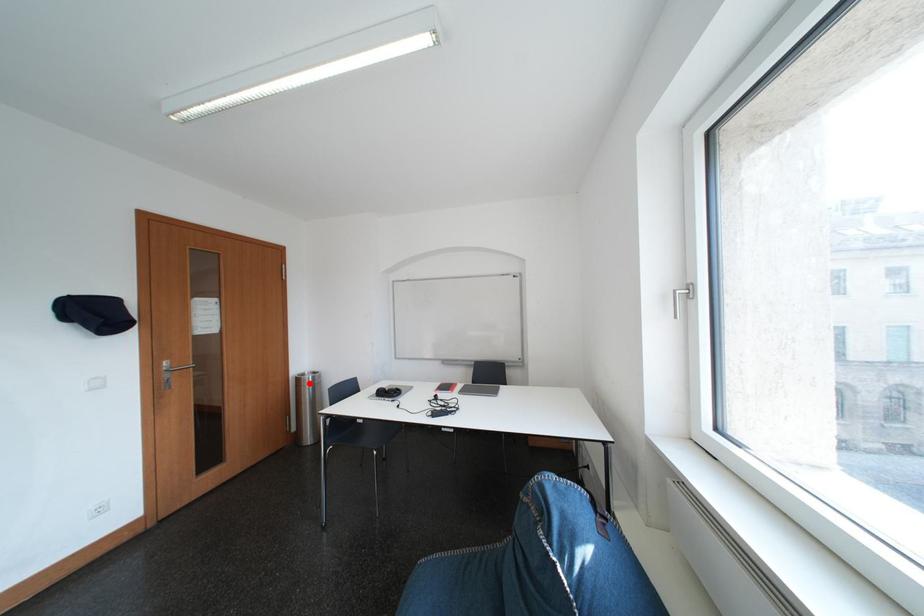
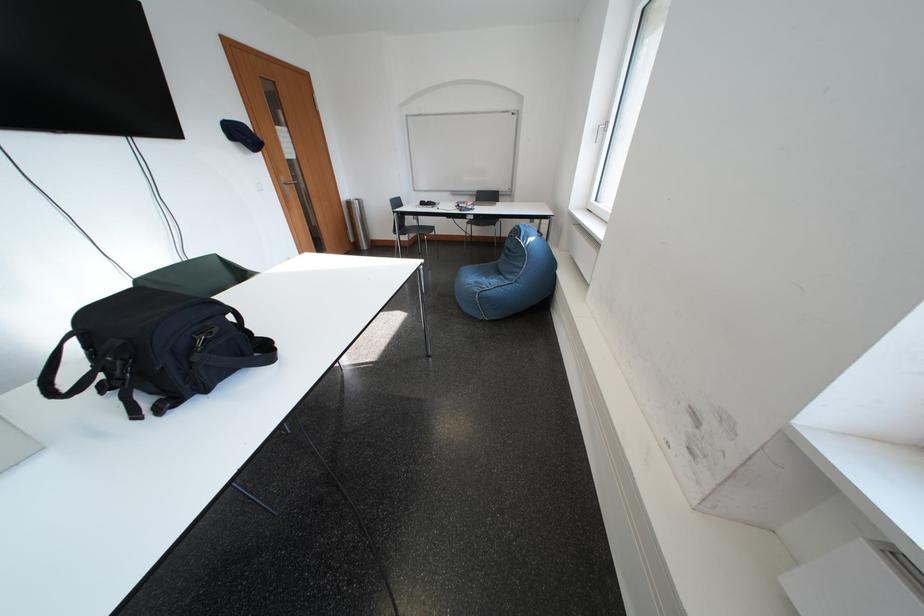
The point at the highlighted location is marked in the first image. Where is the corresponding point in the second image?

(360, 207)